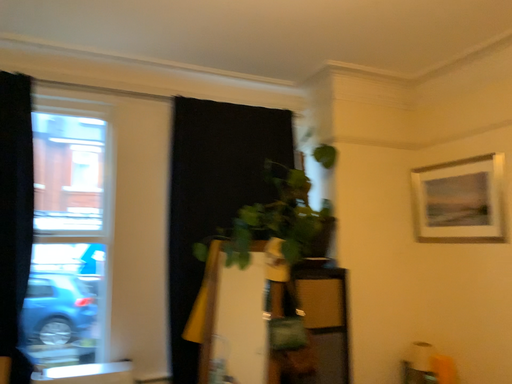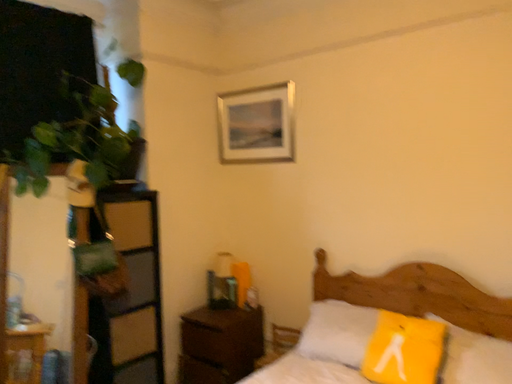
Question: How did the camera likely rotate when shooting the video?

Choices:
 (A) rotated upward
 (B) rotated downward

Answer: (B)